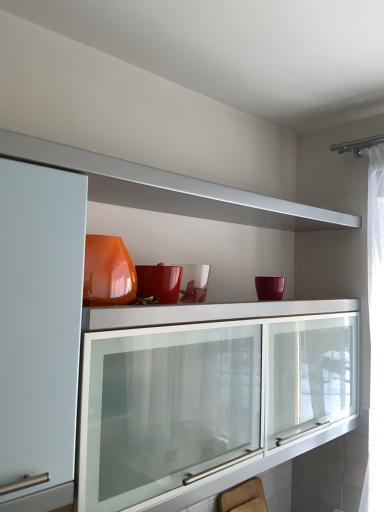
Question: Does wooden swivel chair at lower center have a lesser height compared to matte orange vase at upper center?

Choices:
 (A) yes
 (B) no

Answer: (A)

Question: Can you confirm if wooden swivel chair at lower center is positioned to the right of matte orange vase at upper center?

Choices:
 (A) no
 (B) yes

Answer: (B)

Question: Is wooden swivel chair at lower center positioned beyond the bounds of matte orange vase at upper center?

Choices:
 (A) yes
 (B) no

Answer: (A)

Question: Considering the relative sizes of wooden swivel chair at lower center and matte orange vase at upper center in the image provided, is wooden swivel chair at lower center smaller than matte orange vase at upper center?

Choices:
 (A) yes
 (B) no

Answer: (A)

Question: Is wooden swivel chair at lower center taller than matte orange vase at upper center?

Choices:
 (A) no
 (B) yes

Answer: (A)

Question: Can you confirm if wooden swivel chair at lower center is wider than matte orange vase at upper center?

Choices:
 (A) no
 (B) yes

Answer: (A)

Question: Considering the relative sizes of matte orange vase at upper center and wooden swivel chair at lower center in the image provided, is matte orange vase at upper center thinner than wooden swivel chair at lower center?

Choices:
 (A) no
 (B) yes

Answer: (A)

Question: Is matte orange vase at upper center with wooden swivel chair at lower center?

Choices:
 (A) yes
 (B) no

Answer: (B)

Question: Does matte orange vase at upper center have a lesser height compared to wooden swivel chair at lower center?

Choices:
 (A) no
 (B) yes

Answer: (A)

Question: From the image's perspective, is matte orange vase at upper center above wooden swivel chair at lower center?

Choices:
 (A) yes
 (B) no

Answer: (A)

Question: Is matte orange vase at upper center behind wooden swivel chair at lower center?

Choices:
 (A) no
 (B) yes

Answer: (A)

Question: Is matte orange vase at upper center closer to the viewer compared to wooden swivel chair at lower center?

Choices:
 (A) no
 (B) yes

Answer: (B)

Question: From the image's perspective, relative to wooden swivel chair at lower center, is matte orange vase at upper center above or below?

Choices:
 (A) below
 (B) above

Answer: (B)